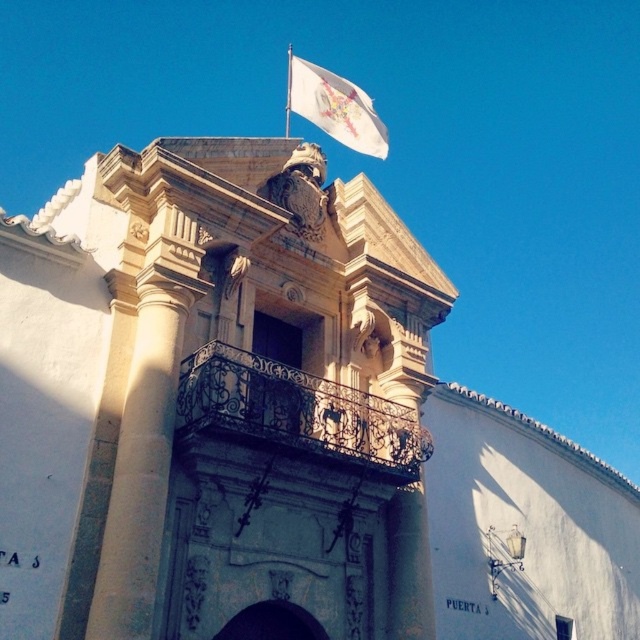
Question: Considering the real-world distances, which object is farthest from the smooth stone column at center?

Choices:
 (A) white fabric flag at upper center
 (B) wrought iron balcony at center

Answer: (A)

Question: Can you confirm if wrought iron balcony at center is positioned above white fabric flag at upper center?

Choices:
 (A) yes
 (B) no

Answer: (B)

Question: Is smooth stone column at center above wrought iron balcony at center?

Choices:
 (A) no
 (B) yes

Answer: (B)

Question: Which point is farther to the camera?

Choices:
 (A) (113, 624)
 (B) (298, 449)
 (C) (371, 125)

Answer: (C)

Question: Estimate the real-world distances between objects in this image. Which object is farther from the white fabric flag at upper center?

Choices:
 (A) smooth stone column at center
 (B) wrought iron balcony at center

Answer: (A)

Question: Does smooth stone column at center have a greater width compared to white fabric flag at upper center?

Choices:
 (A) yes
 (B) no

Answer: (B)